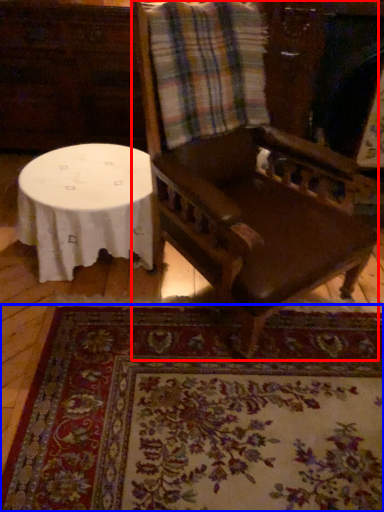
Question: Which object appears farthest to the camera in this image, chair (highlighted by a red box) or mat (highlighted by a blue box)?

Choices:
 (A) chair
 (B) mat

Answer: (B)